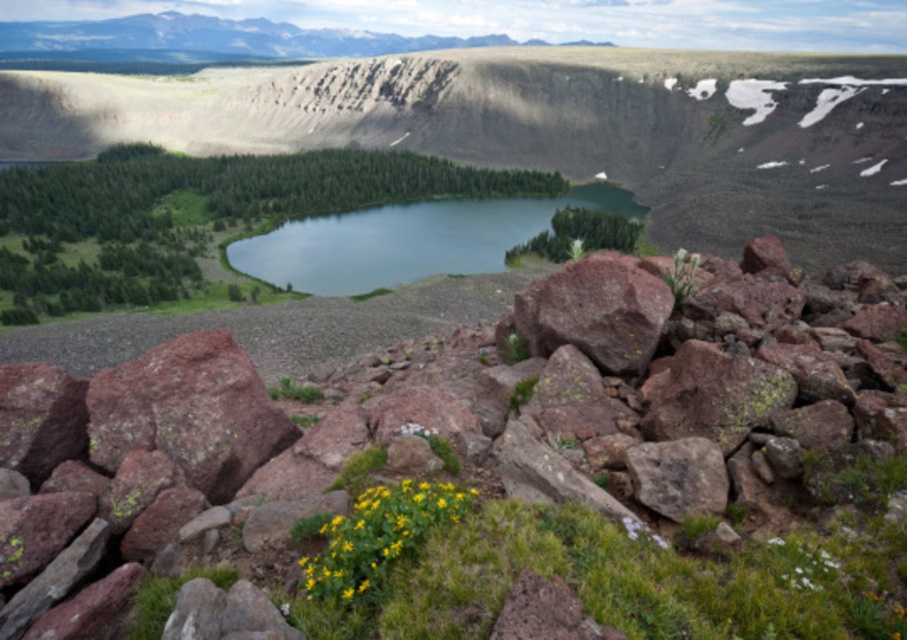
Which is behind, point (545, 472) or point (539, 308)?

The point (539, 308) is more distant.

Which is below, rusty rock at center or rusty stone boulder at center?

rusty rock at center is below.

Identify the location of rusty rock at center. (489, 452).

Does rusty rock at center have a lesser height compared to green glossy water at center?

Indeed, rusty rock at center has a lesser height compared to green glossy water at center.

Does rusty rock at center come in front of green glossy water at center?

That is True.

The height and width of the screenshot is (640, 907). In order to click on rusty rock at center in this screenshot , I will do `click(489, 452)`.

The width and height of the screenshot is (907, 640). What are the coordinates of `rusty rock at center` in the screenshot? It's located at (489, 452).

Between rusty stone boulder at center and yellow matte flower at center, which one has less height?

yellow matte flower at center

Measure the distance between rusty stone boulder at center and yellow matte flower at center.

A distance of 8.51 meters exists between rusty stone boulder at center and yellow matte flower at center.

The image size is (907, 640). What do you see at coordinates (595, 312) in the screenshot?
I see `rusty stone boulder at center` at bounding box center [595, 312].

The width and height of the screenshot is (907, 640). Identify the location of rusty stone boulder at center. (595, 312).